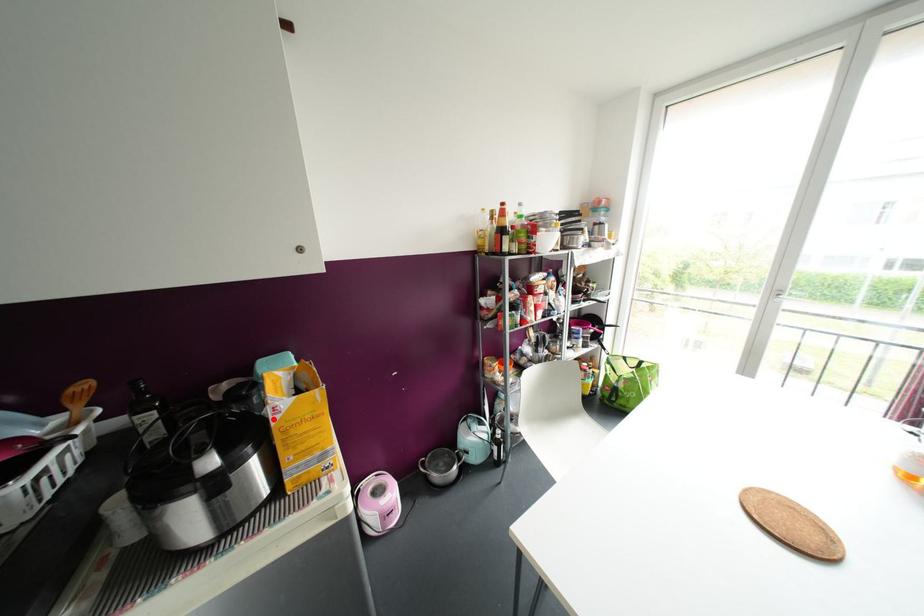
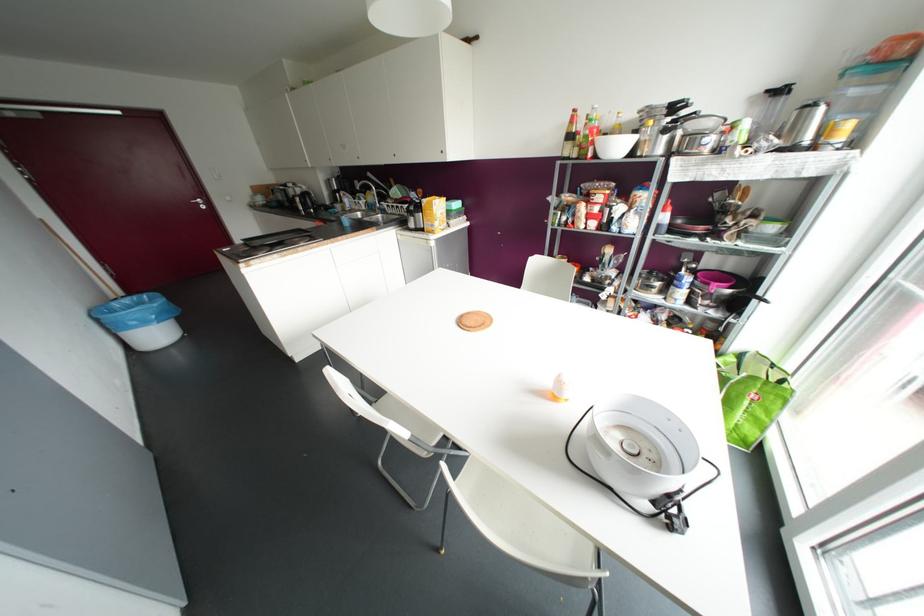
Question: I am providing you with two images of the same scene from different viewpoints. Given a red point in image1, look at the same physical point in image2. Is it:

Choices:
 (A) Closer to the viewpoint
 (B) Farther from the viewpoint

Answer: (A)